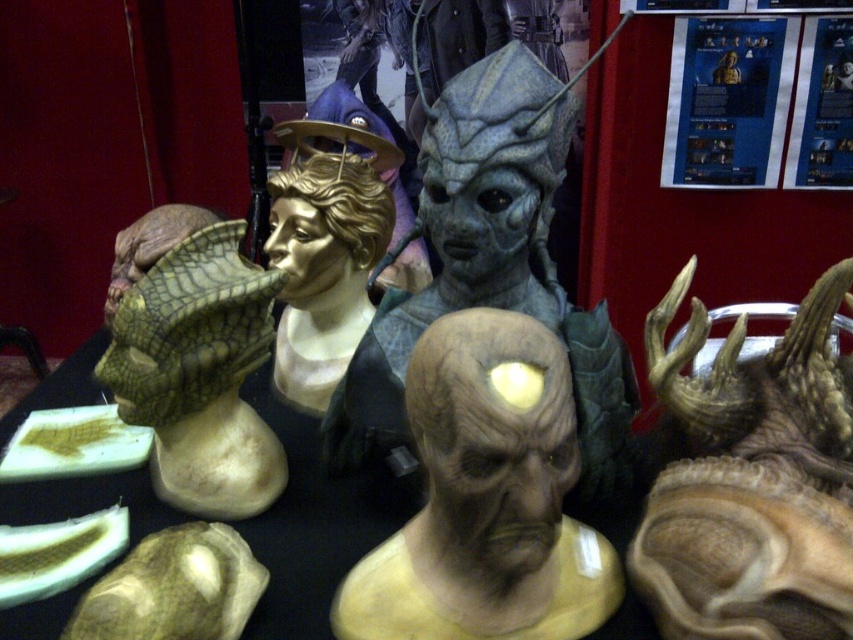
Does point (514, 428) come behind point (241, 492)?

No, it is not.

What do you see at coordinates (486, 497) in the screenshot? This screenshot has height=640, width=853. I see `matte gray mask at center` at bounding box center [486, 497].

Between point (608, 600) and point (213, 515), which one is positioned in front?

Point (608, 600)

Where is `matte gray mask at center`? The image size is (853, 640). matte gray mask at center is located at coordinates (486, 497).

What do you see at coordinates (751, 480) in the screenshot? The width and height of the screenshot is (853, 640). I see `shiny metallic horns at upper right` at bounding box center [751, 480].

How far apart are shiny metallic horns at upper right and matte gray mask at center?

shiny metallic horns at upper right and matte gray mask at center are 9.94 inches apart.

Is point (825, 419) positioned in front of point (440, 465)?

No, it is behind (440, 465).

I want to click on shiny metallic horns at upper right, so click(x=751, y=480).

Who is lower down, shiny metallic horns at upper right or green scaly mask at left?

shiny metallic horns at upper right is lower down.

Who is shorter, shiny metallic horns at upper right or green scaly mask at left?

green scaly mask at left

Measure the distance between shiny metallic horns at upper right and camera.

shiny metallic horns at upper right and camera are 34.23 inches apart.

Find the location of a particular element. This screenshot has width=853, height=640. shiny metallic horns at upper right is located at coordinates (751, 480).